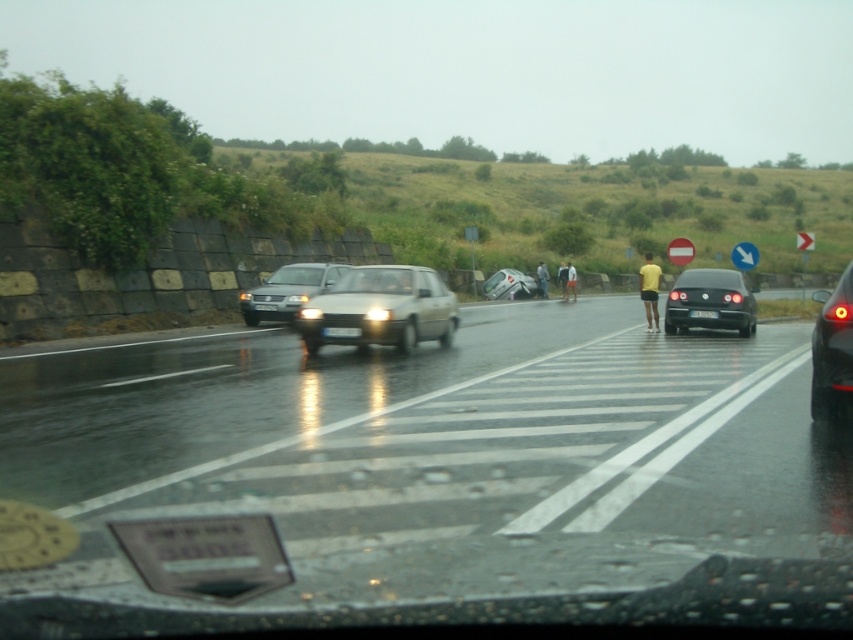
You are a passenger in a car and want to know the exact location of the silver metallic sedan at center. Can you tell me its coordinates?

The silver metallic sedan at center is located at coordinates point (x=287, y=291).

Based on the photo, you are a driver trying to see the road ahead through the wet windshield. You notice the silver metallic sedan at center and the black plastic license plate at center. Which object is positioned higher in your field of view?

The silver metallic sedan at center is much taller than the black plastic license plate at center, so it is positioned higher in your field of view.

You are a passenger in the vehicle and notice the silver metallic sedan at center. Based on its position relative to the dashboard and the road ahead, can you determine if it is parked or moving?

The silver metallic sedan at center is located at point (x=287, y=291), which places it in the center of the scene. Since the dashboard shows 0 kmh, it indicates the vehicle is stationary, so the silver metallic sedan at center is parked.